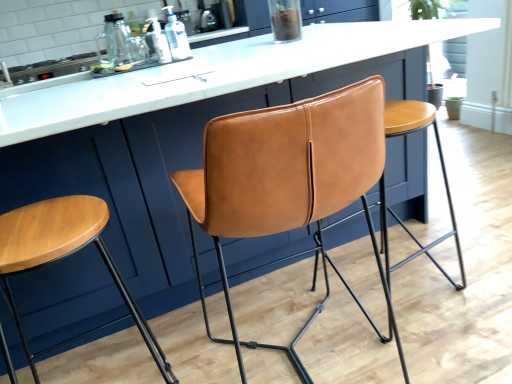
Question: Considering the positions of matte leather stool at center, the 2th stool in the left-to-right sequence, and wooden stool at left, which appears as the 1th stool when viewed from the left, in the image, is matte leather stool at center, the 2th stool in the left-to-right sequence, taller or shorter than wooden stool at left, which appears as the 1th stool when viewed from the left,?

Choices:
 (A) tall
 (B) short

Answer: (B)

Question: Relative to wooden stool at left, which appears as the 1th stool when viewed from the left, is matte leather stool at center, the 2th stool in the left-to-right sequence, in front or behind?

Choices:
 (A) behind
 (B) front

Answer: (A)

Question: Estimate the real-world distances between objects in this image. Which object is closer to the wooden stool at left, which appears as the 1th stool when viewed from the left?

Choices:
 (A) cognac leather chair at center
 (B) metallic stove top at upper left
 (C) clear plastic bottle at center, which is the first bottle from right to left
 (D) matte leather stool at center, the 2th stool in the left-to-right sequence
 (E) translucent plastic bottle at upper center, which is the 1th bottle in left-to-right order

Answer: (A)

Question: Estimate the real-world distances between objects in this image. Which object is closer to the metallic stove top at upper left?

Choices:
 (A) wooden stool at left, which appears as the 1th stool when viewed from the left
 (B) matte leather stool at center, which is the 1th stool in right-to-left order
 (C) clear plastic bottle at center, the second bottle when ordered from left to right
 (D) cognac leather chair at center
 (E) translucent plastic bottle at upper center, which is the 1th bottle in left-to-right order

Answer: (E)